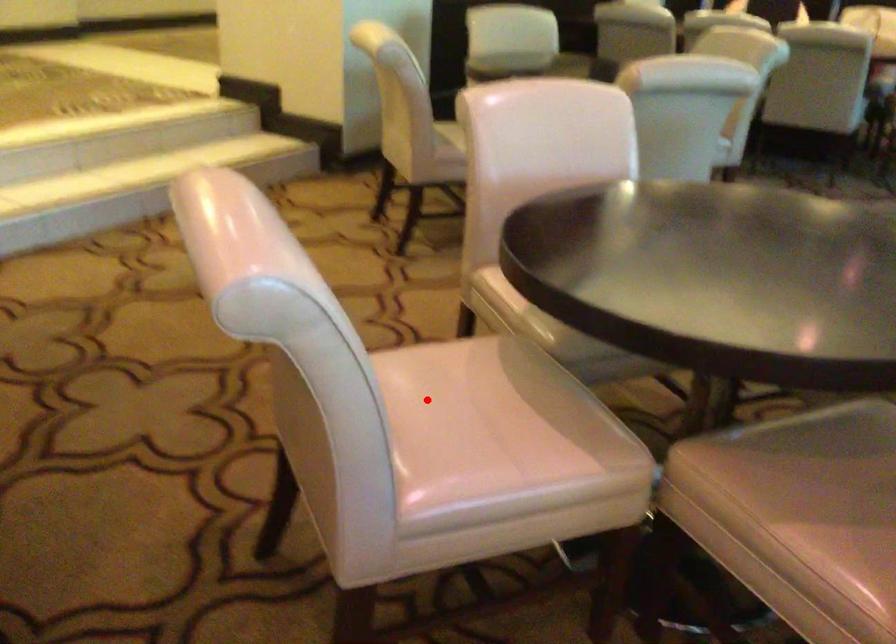
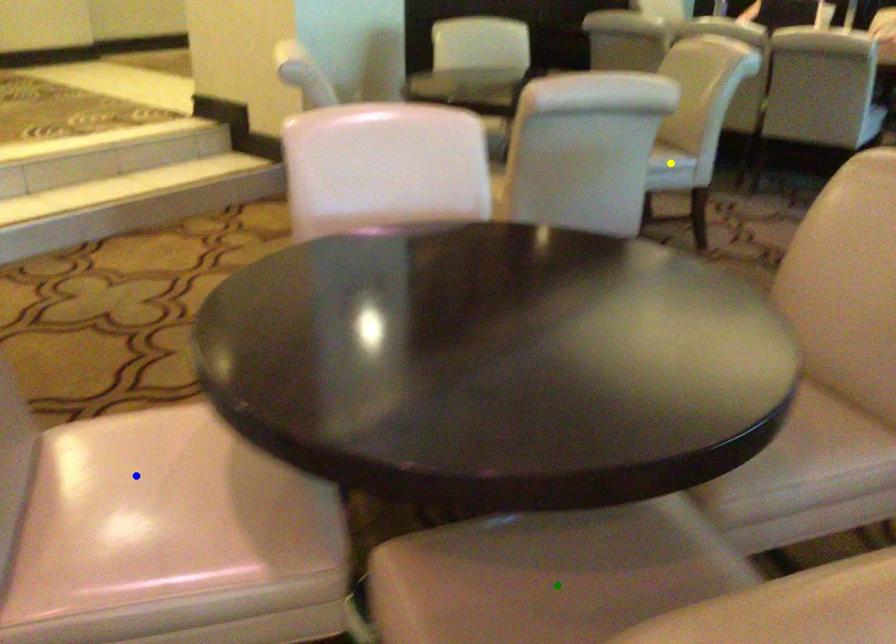
Question: I am providing you with two images of the same scene from different viewpoints. A red point is marked on the first image. You are given multiple points on the second image. Which point in image 2 represents the same 3d spot as the red point in image 1?

Choices:
 (A) green point
 (B) blue point
 (C) yellow point

Answer: (B)